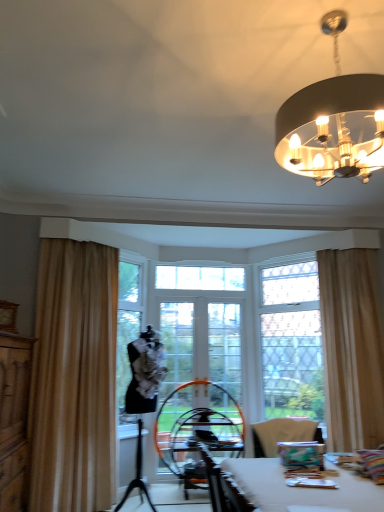
Question: From the image's perspective, does wooden dresser at left appear lower than black leather swivel chair at center?

Choices:
 (A) yes
 (B) no

Answer: (B)

Question: Is wooden dresser at left facing away from black leather swivel chair at center?

Choices:
 (A) yes
 (B) no

Answer: (B)

Question: Can we say wooden dresser at left lies outside black leather swivel chair at center?

Choices:
 (A) yes
 (B) no

Answer: (A)

Question: Would you say wooden dresser at left is a long distance from black leather swivel chair at center?

Choices:
 (A) no
 (B) yes

Answer: (B)

Question: Considering the relative positions of wooden dresser at left and black leather swivel chair at center in the image provided, is wooden dresser at left to the right of black leather swivel chair at center from the viewer's perspective?

Choices:
 (A) no
 (B) yes

Answer: (A)

Question: Does wooden dresser at left have a larger size compared to black leather swivel chair at center?

Choices:
 (A) yes
 (B) no

Answer: (A)

Question: From the image's perspective, is matte black chandelier at upper right on white glossy table at lower right?

Choices:
 (A) no
 (B) yes

Answer: (B)

Question: Does matte black chandelier at upper right have a larger size compared to white glossy table at lower right?

Choices:
 (A) no
 (B) yes

Answer: (B)

Question: Would you consider matte black chandelier at upper right to be distant from white glossy table at lower right?

Choices:
 (A) no
 (B) yes

Answer: (B)

Question: Is matte black chandelier at upper right in front of white glossy table at lower right?

Choices:
 (A) yes
 (B) no

Answer: (B)

Question: Is matte black chandelier at upper right not inside white glossy table at lower right?

Choices:
 (A) yes
 (B) no

Answer: (A)

Question: Is matte black chandelier at upper right oriented away from white glossy table at lower right?

Choices:
 (A) yes
 (B) no

Answer: (B)

Question: Considering the relative sizes of beige fabric curtain at left, which is the 2th curtain from right to left, and clear glass screen door at center in the image provided, is beige fabric curtain at left, which is the 2th curtain from right to left, shorter than clear glass screen door at center?

Choices:
 (A) yes
 (B) no

Answer: (B)